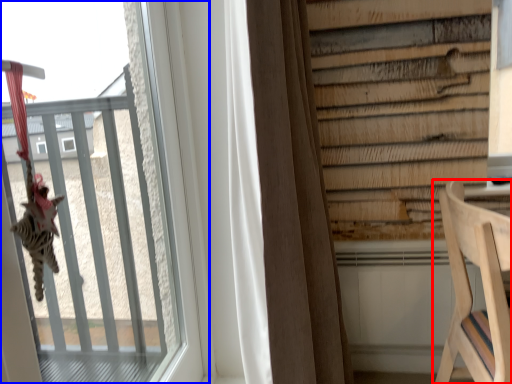
Question: Which of the following is the closest to the observer, furniture (highlighted by a red box) or window (highlighted by a blue box)?

Choices:
 (A) furniture
 (B) window

Answer: (B)